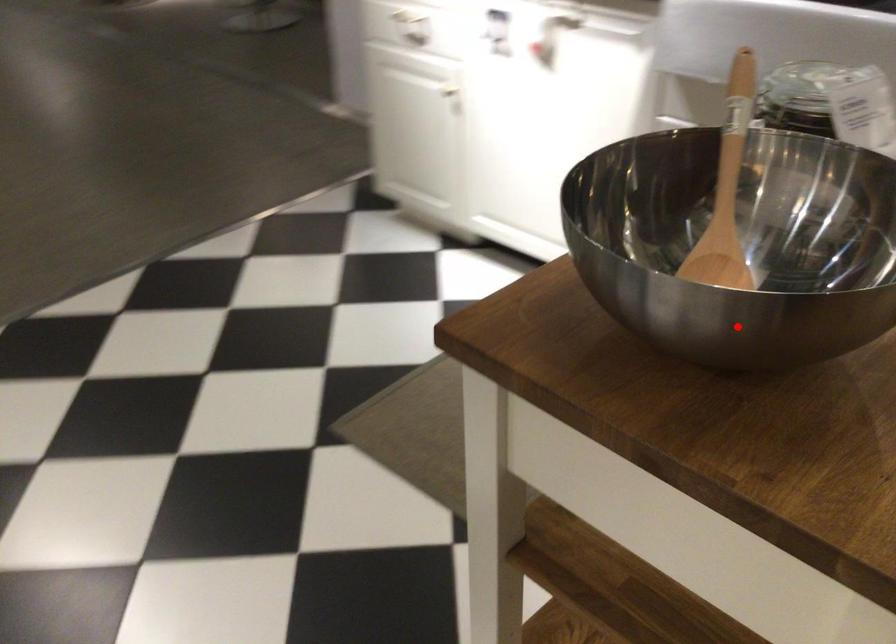
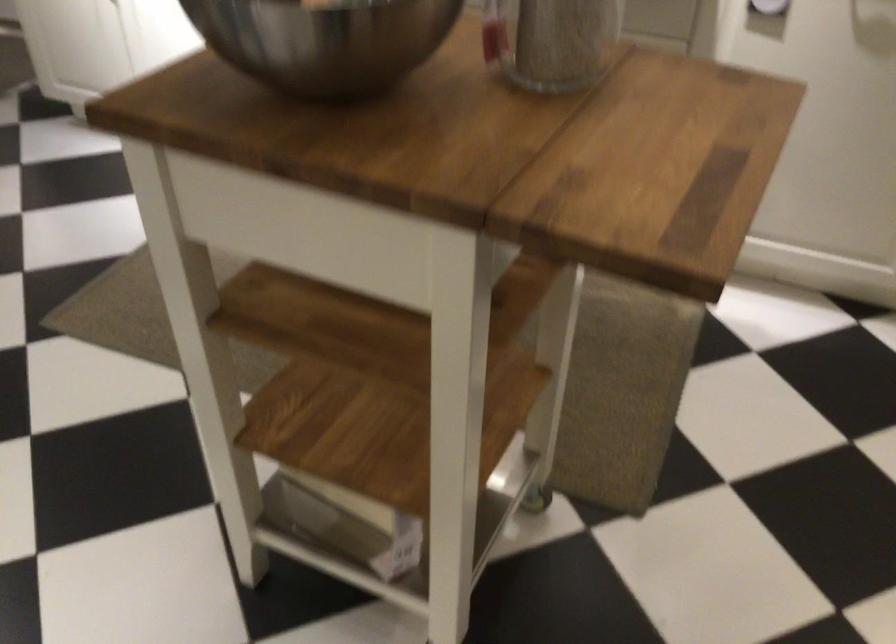
Where in the second image is the point corresponding to the highlighted location from the first image?

(323, 41)